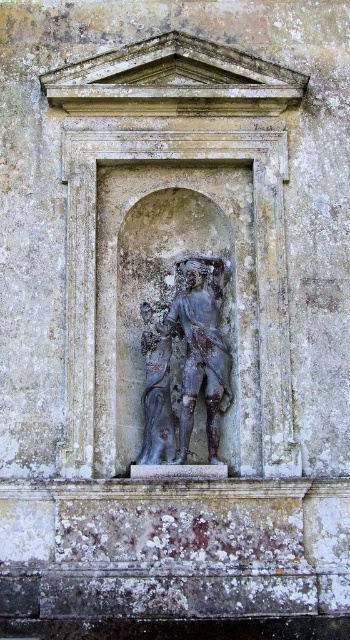
Question: Which point is closer to the camera?

Choices:
 (A) (169, 442)
 (B) (192, 296)

Answer: (A)

Question: Can you confirm if bronze statue at center is positioned above dark gray stone statue at center?

Choices:
 (A) no
 (B) yes

Answer: (B)

Question: Is bronze statue at center thinner than dark gray stone statue at center?

Choices:
 (A) yes
 (B) no

Answer: (B)

Question: Which point appears farthest from the camera in this image?

Choices:
 (A) (194, 352)
 (B) (169, 442)

Answer: (A)

Question: In this image, where is bronze statue at center located relative to dark gray stone statue at center?

Choices:
 (A) below
 (B) above

Answer: (B)